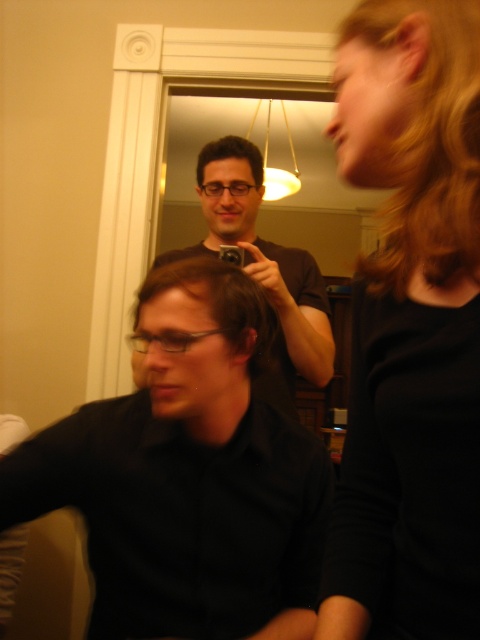
Does point (402, 417) come behind point (257, 289)?

No.

Is black matte hair at upper right to the right of brown matte hair at center from the viewer's perspective?

Indeed, black matte hair at upper right is positioned on the right side of brown matte hair at center.

Does point (453, 252) lie in front of point (154, 284)?

Yes, point (453, 252) is in front of point (154, 284).

Find the location of a particular element. Image resolution: width=480 pixels, height=640 pixels. black matte hair at upper right is located at coordinates (409, 317).

Is black matte shirt at center to the left of brown matte hair at center from the viewer's perspective?

Indeed, black matte shirt at center is positioned on the left side of brown matte hair at center.

The height and width of the screenshot is (640, 480). What do you see at coordinates (187, 474) in the screenshot? I see `black matte shirt at center` at bounding box center [187, 474].

Which is in front, point (205, 536) or point (229, 336)?

Point (229, 336)

Where is `black matte shirt at center`? The height and width of the screenshot is (640, 480). black matte shirt at center is located at coordinates (187, 474).

Which is above, blonde curly hair at upper right or matte black shirt at center?

blonde curly hair at upper right is above.

Does blonde curly hair at upper right have a larger size compared to matte black shirt at center?

No, blonde curly hair at upper right is not bigger than matte black shirt at center.

Which is in front, point (385, 209) or point (308, 253)?

Point (385, 209) is in front.

Identify the location of blonde curly hair at upper right. The height and width of the screenshot is (640, 480). (414, 134).